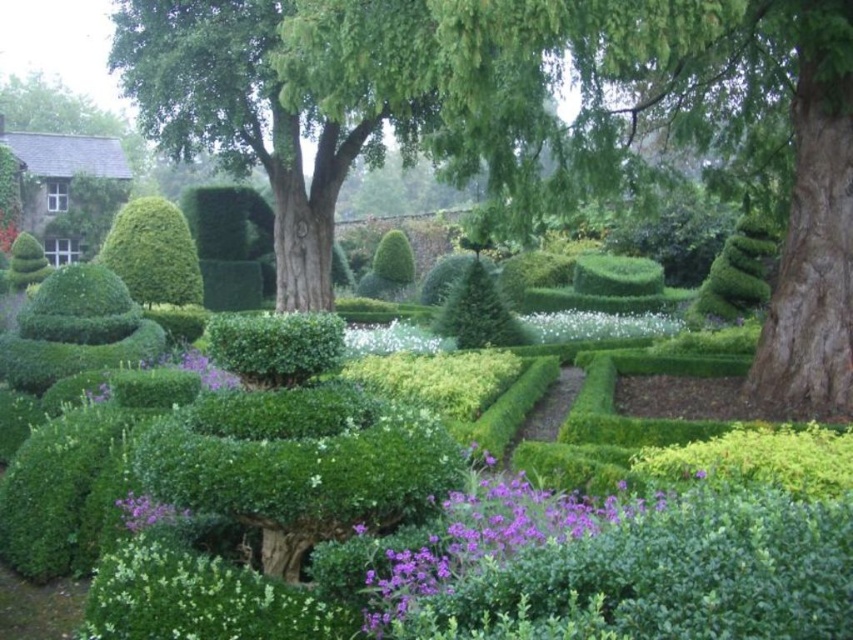
Question: Among these objects, which one is nearest to the camera?

Choices:
 (A) white fluffy flower at center
 (B) white fluffy flowers at center
 (C) white matte flower at center

Answer: (C)

Question: Estimate the real-world distances between objects in this image. Which object is farther from the green leafy tree at center?

Choices:
 (A) white fluffy flower at center
 (B) purple matte flower at center
 (C) white fluffy flowers at center
 (D) purple matte flower at lower left

Answer: (D)

Question: From the image, what is the correct spatial relationship of green leafy tree at center in relation to purple matte flower at lower left?

Choices:
 (A) below
 (B) above

Answer: (B)

Question: Does purple matte flower at center appear over purple matte flower at lower left?

Choices:
 (A) no
 (B) yes

Answer: (B)

Question: Does green leafy tree at center have a greater width compared to purple matte flower at center?

Choices:
 (A) no
 (B) yes

Answer: (B)

Question: Estimate the real-world distances between objects in this image. Which object is farther from the white matte flower at center?

Choices:
 (A) purple matte flower at lower left
 (B) green leafy tree at center
 (C) purple matte flower at center
 (D) white fluffy flowers at center

Answer: (D)